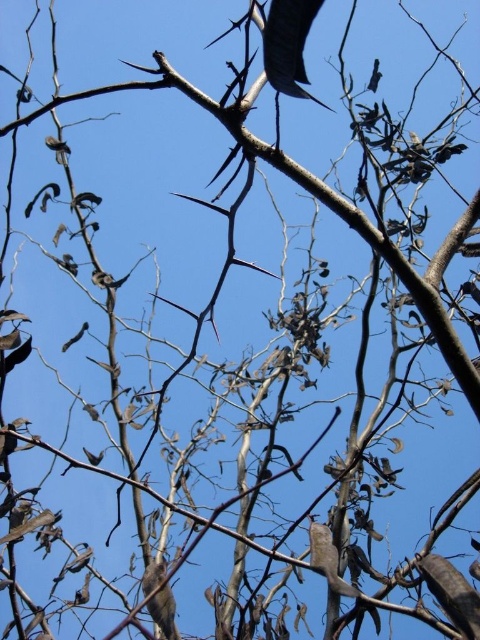
Can you confirm if shiny black leaf at upper center is positioned to the left of brown feathered bird at lower center?

Incorrect, shiny black leaf at upper center is not on the left side of brown feathered bird at lower center.

Is shiny black leaf at upper center bigger than brown feathered bird at lower center?

No, shiny black leaf at upper center is not bigger than brown feathered bird at lower center.

Is point (299, 6) less distant than point (158, 595)?

Yes.

You are a GUI agent. You are given a task and a screenshot of the screen. Output one action in this format:
    pyautogui.click(x=<x>, y=<y>)
    Task: Click on the shiny black leaf at upper center
    This screenshot has height=640, width=480.
    Given the screenshot: What is the action you would take?
    pyautogui.click(x=288, y=44)